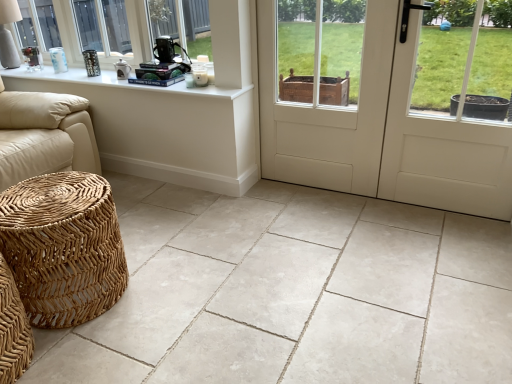
Identify the location of blank space situated above natural stone tile at lower left (from a real-world perspective). (265, 280).